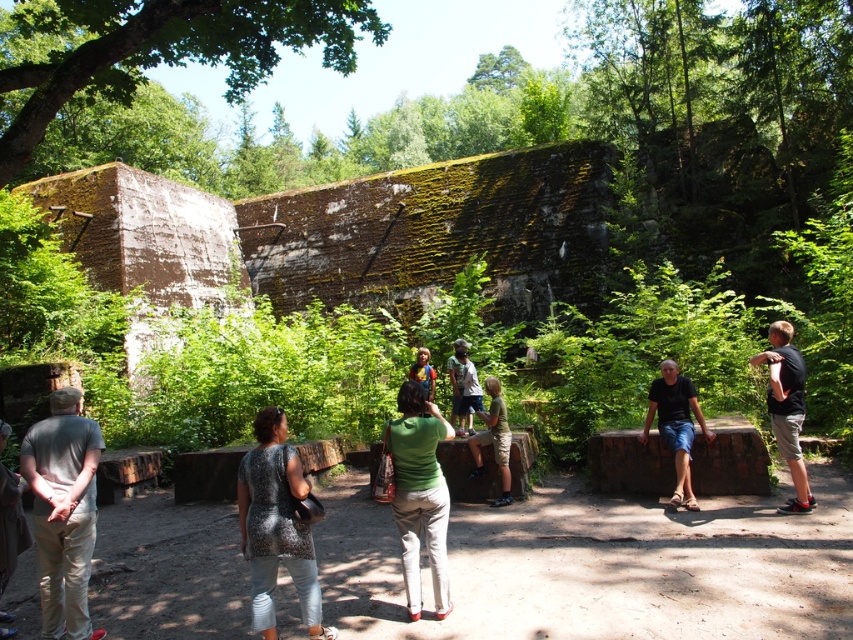
Question: Is black cotton t-shirt at right closer to camera compared to dark blue denim shorts at center?

Choices:
 (A) yes
 (B) no

Answer: (A)

Question: Which point appears farthest from the camera in this image?

Choices:
 (A) (682, 486)
 (B) (389, 424)

Answer: (A)

Question: Does dark blue denim shorts at center appear over light brown wooden bench at center?

Choices:
 (A) yes
 (B) no

Answer: (B)

Question: Does speckled fabric dress at center have a larger size compared to dark blue denim shorts at center?

Choices:
 (A) no
 (B) yes

Answer: (A)

Question: Which point is closer to the camera?

Choices:
 (A) speckled fabric dress at center
 (B) matte gray shirt at left
 (C) black cotton t-shirt at right
 (D) dark blue denim shorts at center

Answer: (A)

Question: Among these objects, which one is farthest from the camera?

Choices:
 (A) black cotton t-shirt at right
 (B) green fabric shirt at center
 (C) matte gray shirt at left
 (D) green mossy wall at upper center

Answer: (D)